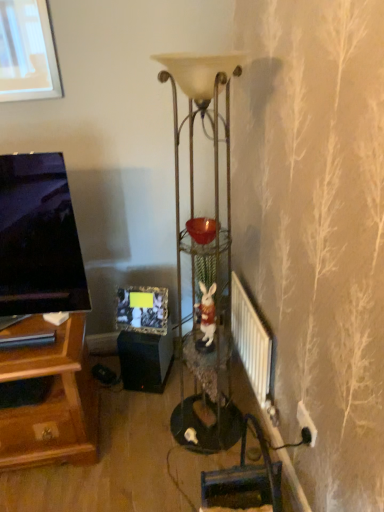
Identify the location of free space in front of black matte speaker at lower center. The image size is (384, 512). (139, 410).